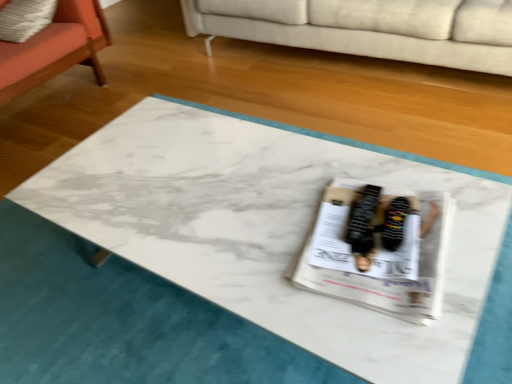
Locate an element on the screen. This screenshot has width=512, height=384. free point to the right of white glossy magazine at center is located at coordinates (463, 222).